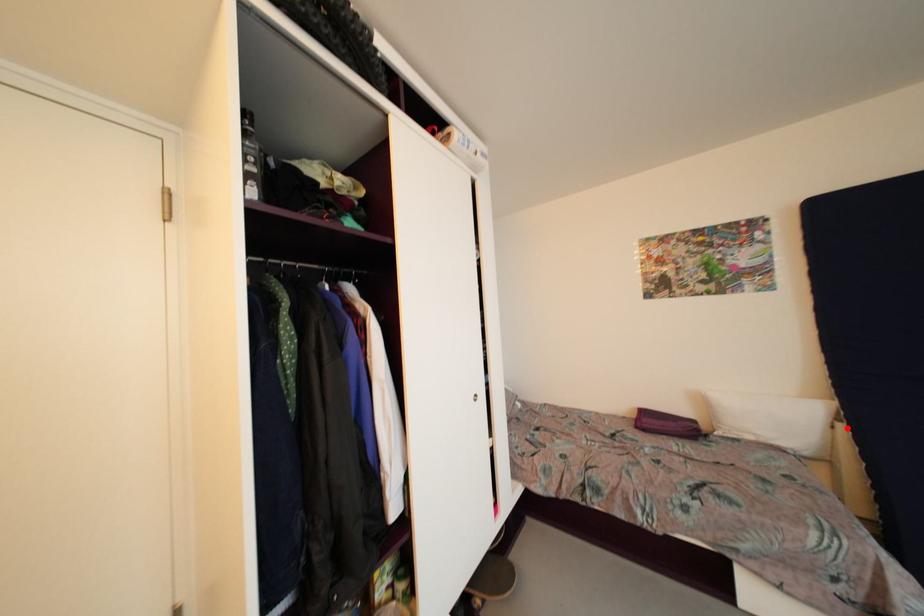
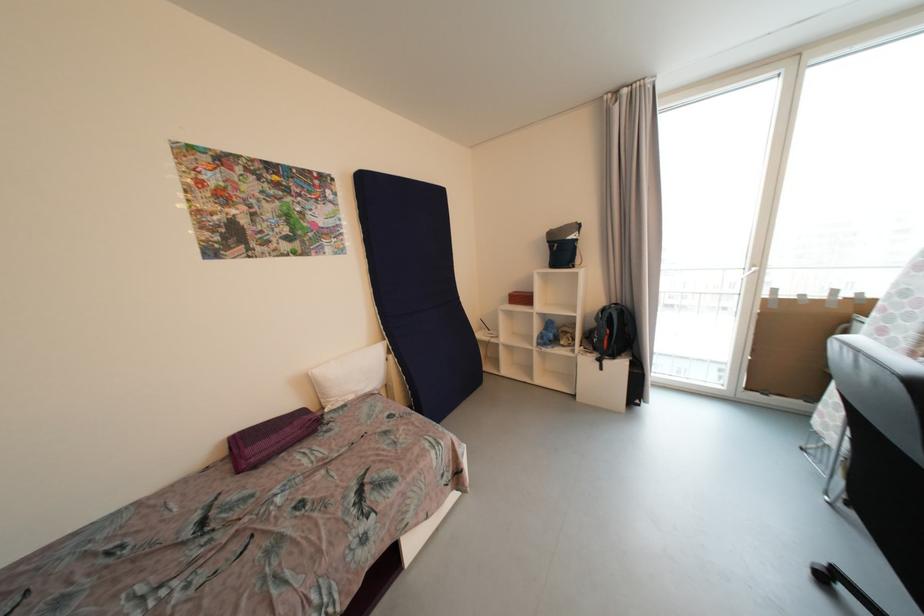
In the second image, find the point that corresponds to the highlighted location in the first image.

(396, 359)